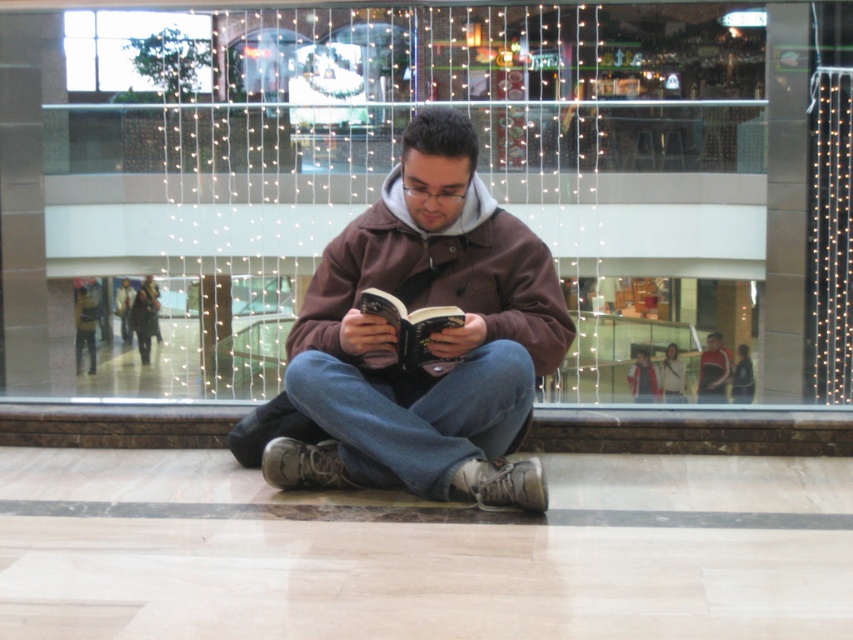
Question: Which point appears closest to the camera in this image?

Choices:
 (A) (430, 392)
 (B) (427, 364)
 (C) (730, 364)

Answer: (A)

Question: Does hardcover book at center come behind matte black jacket at center?

Choices:
 (A) no
 (B) yes

Answer: (A)

Question: Which object is positioned farthest from the matte black jacket at center?

Choices:
 (A) brown soft hoodie at center
 (B) hardcover book at center

Answer: (B)

Question: Which is farther from the brown soft hoodie at center?

Choices:
 (A) hardcover book at center
 (B) matte black jacket at center

Answer: (B)

Question: From the image, what is the correct spatial relationship of brown soft hoodie at center in relation to matte black jacket at center?

Choices:
 (A) left
 (B) right

Answer: (A)

Question: Can you confirm if brown soft hoodie at center is smaller than matte black jacket at center?

Choices:
 (A) no
 (B) yes

Answer: (B)